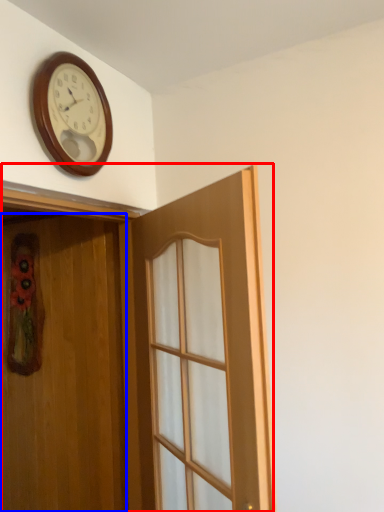
Question: Which object is further to the camera taking this photo, door (highlighted by a red box) or door (highlighted by a blue box)?

Choices:
 (A) door
 (B) door

Answer: (B)